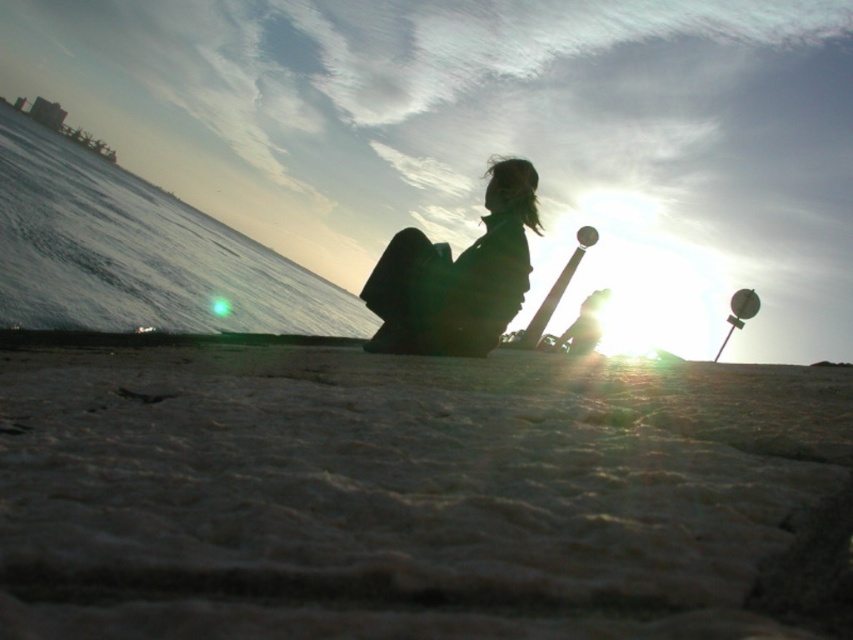
How far apart are gray water at lower left and silhouette fabric at center?

gray water at lower left is 35.43 feet from silhouette fabric at center.

This screenshot has height=640, width=853. What are the coordinates of `gray water at lower left` in the screenshot? It's located at (137, 253).

This screenshot has height=640, width=853. I want to click on gray water at lower left, so click(x=137, y=253).

Is sandy textured ground at lower center to the right of gray water at lower left from the viewer's perspective?

Correct, you'll find sandy textured ground at lower center to the right of gray water at lower left.

Does sandy textured ground at lower center have a lesser height compared to gray water at lower left?

Indeed, sandy textured ground at lower center has a lesser height compared to gray water at lower left.

Which is behind, point (612, 552) or point (12, 259)?

The point (12, 259) is more distant.

At what (x,y) coordinates should I click in order to perform the action: click on sandy textured ground at lower center. Please return your answer as a coordinate pair (x, y). Looking at the image, I should click on (415, 493).

Can you confirm if sandy textured ground at lower center is taller than silhouette fabric at center?

Incorrect, sandy textured ground at lower center's height is not larger of silhouette fabric at center's.

Can you confirm if sandy textured ground at lower center is shorter than silhouette fabric at center?

Yes.

Does point (641, 628) come behind point (461, 268)?

No, (641, 628) is closer to viewer.

Find the location of a particular element. Image resolution: width=853 pixels, height=640 pixels. sandy textured ground at lower center is located at coordinates (415, 493).